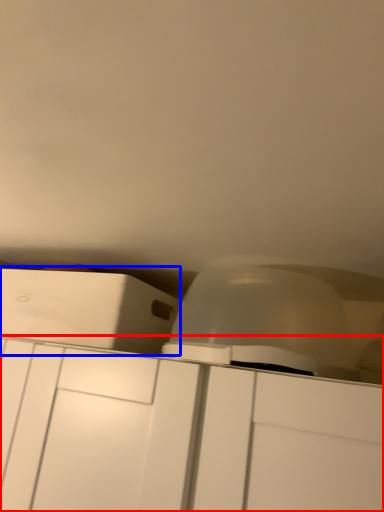
Question: Which object appears farthest to the camera in this image, cabinetry (highlighted by a red box) or cabinetry (highlighted by a blue box)?

Choices:
 (A) cabinetry
 (B) cabinetry

Answer: (B)